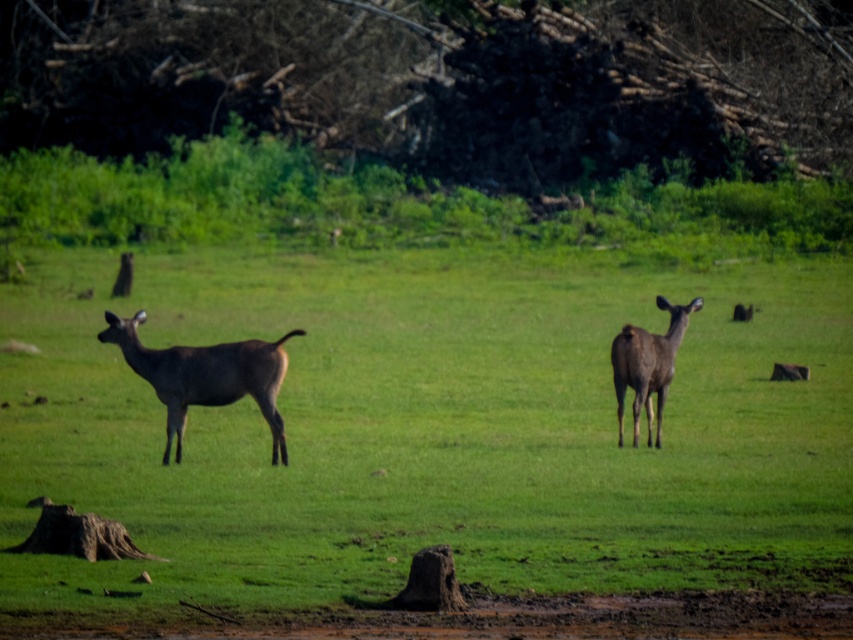
Question: Is the position of brown fur deer at center more distant than that of shiny brown deer at center?

Choices:
 (A) yes
 (B) no

Answer: (B)

Question: Is the position of brown fur deer at center less distant than that of shiny brown deer at center?

Choices:
 (A) yes
 (B) no

Answer: (A)

Question: Which of the following is the closest to the observer?

Choices:
 (A) shiny brown deer at center
 (B) brown fur deer at center

Answer: (B)

Question: Which of the following is the farthest from the observer?

Choices:
 (A) brown fur deer at center
 (B) brown matte deer at center

Answer: (B)

Question: Which point is farther to the camera?

Choices:
 (A) (115, 326)
 (B) (380, 444)
 (C) (657, 337)

Answer: (C)

Question: Is shiny brown deer at center smaller than brown matte deer at center?

Choices:
 (A) no
 (B) yes

Answer: (A)